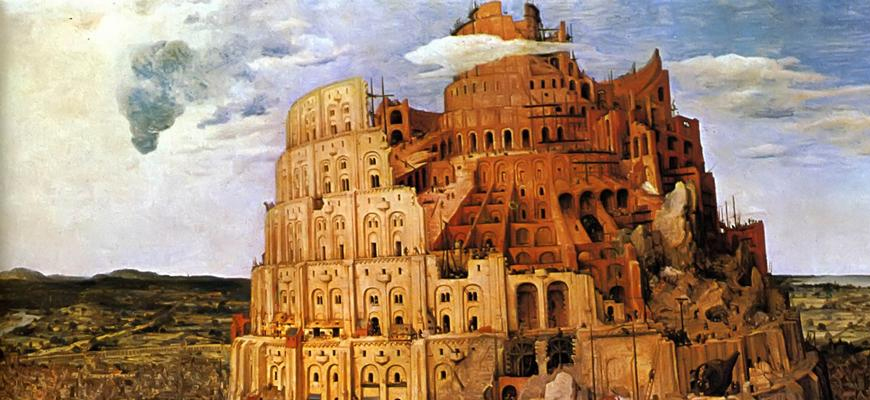
Where is `window`? window is located at coordinates (397, 378).